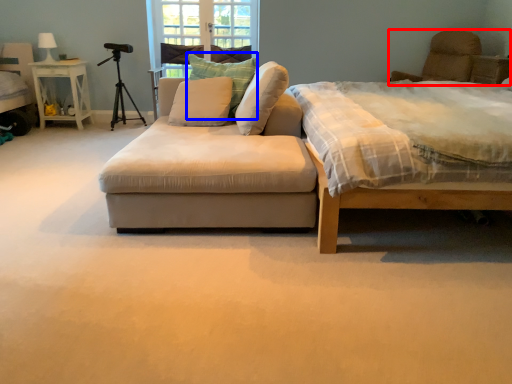
Question: Which point is closer to the camera, swivel chair (highlighted by a red box) or pillow (highlighted by a blue box)?

Choices:
 (A) swivel chair
 (B) pillow

Answer: (B)